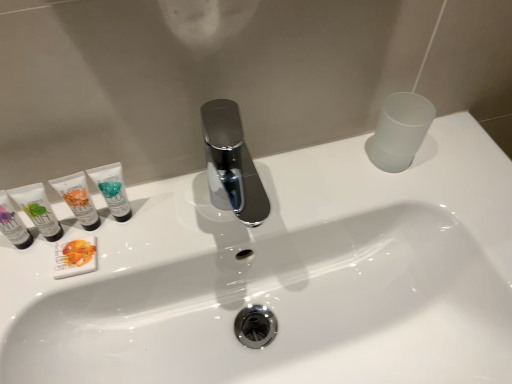
Locate an element on the screen. unoccupied region to the right of white matte tube at left, the 4th toiletry positioned from the left is located at coordinates (190, 219).